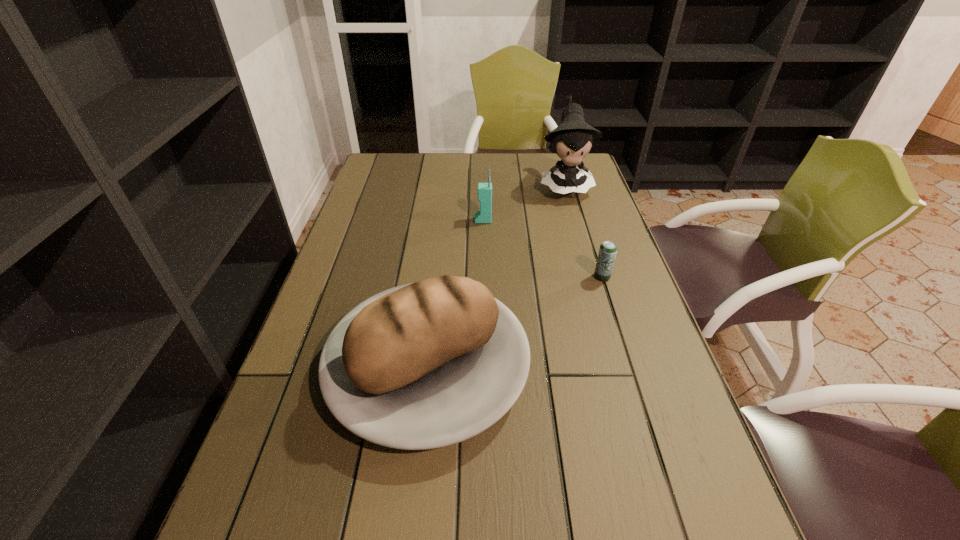
Image resolution: width=960 pixels, height=540 pixels. Identify the location of vacant space that satisfies the following two spatial constraints: 1. on the keypad of the cellular telephone; 2. on the back side of the beer can. (484, 277).

This screenshot has width=960, height=540. What are the coordinates of `free spot that satisfies the following two spatial constraints: 1. at the face of the farthest object; 2. on the left side of the third farthest object` in the screenshot? It's located at (591, 277).

Find the location of a particular element. Image resolution: width=960 pixels, height=540 pixels. free spot that satisfies the following two spatial constraints: 1. on the keypad of the cellular telephone; 2. on the left side of the beer can is located at coordinates (484, 277).

You are a GUI agent. You are given a task and a screenshot of the screen. Output one action in this format:
    pyautogui.click(x=<x>, y=<y>)
    Task: Click on the blank space that satisfies the following two spatial constraints: 1. at the face of the doll; 2. on the left side of the beer can
    The height and width of the screenshot is (540, 960).
    Given the screenshot: What is the action you would take?
    pyautogui.click(x=591, y=277)

Where is `blank space that satisfies the following two spatial constraints: 1. on the keypad of the second farthest object; 2. on the front side of the bread`? The width and height of the screenshot is (960, 540). blank space that satisfies the following two spatial constraints: 1. on the keypad of the second farthest object; 2. on the front side of the bread is located at coordinates (484, 368).

Locate an element on the screen. vacant space that satisfies the following two spatial constraints: 1. on the keypad of the shortest object; 2. on the left side of the second farthest object is located at coordinates (484, 277).

Locate an element on the screen. vacant point that satisfies the following two spatial constraints: 1. at the face of the doll; 2. on the keypad of the second farthest object is located at coordinates (575, 220).